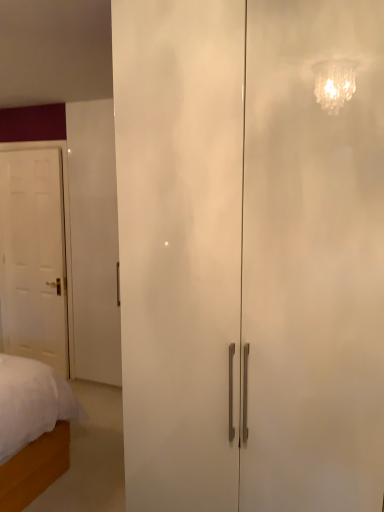
Question: From the image's perspective, relative to white matte door at left, acting as the second door starting from the right, is white glossy cabinet at center, which is the first door in right-to-left order, above or below?

Choices:
 (A) below
 (B) above

Answer: (A)

Question: In the image, is white glossy cabinet at center, the second door from the left, positioned in front of or behind white matte door at left, marked as the 2th door in a front-to-back arrangement?

Choices:
 (A) front
 (B) behind

Answer: (A)

Question: In terms of height, does white glossy cabinet at center, the second door in the back-to-front sequence, look taller or shorter compared to white matte door at left, the first door when ordered from back to front?

Choices:
 (A) tall
 (B) short

Answer: (A)

Question: Considering the relative positions of white matte door at left, acting as the second door starting from the right, and white glossy cabinet at center, the first door when ordered from front to back, in the image provided, is white matte door at left, acting as the second door starting from the right, to the left or to the right of white glossy cabinet at center, the first door when ordered from front to back,?

Choices:
 (A) right
 (B) left

Answer: (B)

Question: From the image's perspective, is white matte door at left, acting as the second door starting from the right, above or below white glossy cabinet at center, the first door when ordered from front to back?

Choices:
 (A) below
 (B) above

Answer: (B)

Question: Looking at their shapes, would you say white matte door at left, acting as the second door starting from the right, is wider or thinner than white glossy cabinet at center, which is the first door in right-to-left order?

Choices:
 (A) wide
 (B) thin

Answer: (B)

Question: Is white matte door at left, acting as the second door starting from the right, taller or shorter than white glossy cabinet at center, the second door in the back-to-front sequence?

Choices:
 (A) short
 (B) tall

Answer: (A)